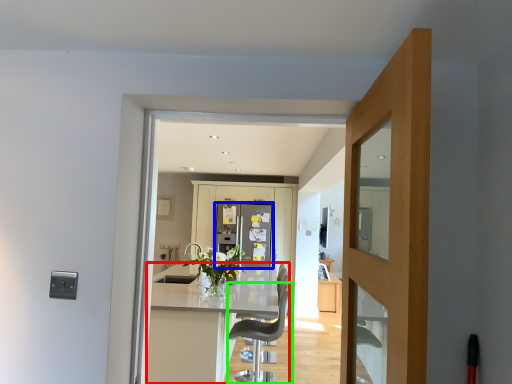
Question: Which is nearer to the kitchen & dining room table (highlighted by a red box)? refrigerator (highlighted by a blue box) or chair (highlighted by a green box).

Choices:
 (A) refrigerator
 (B) chair

Answer: (B)